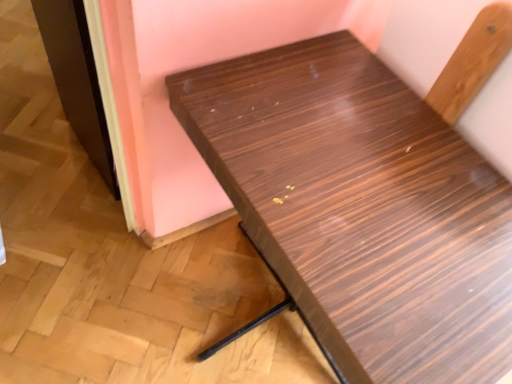
Where is `free space above wooden table at center (from a real-world perspective)`? This screenshot has height=384, width=512. free space above wooden table at center (from a real-world perspective) is located at coordinates (347, 194).